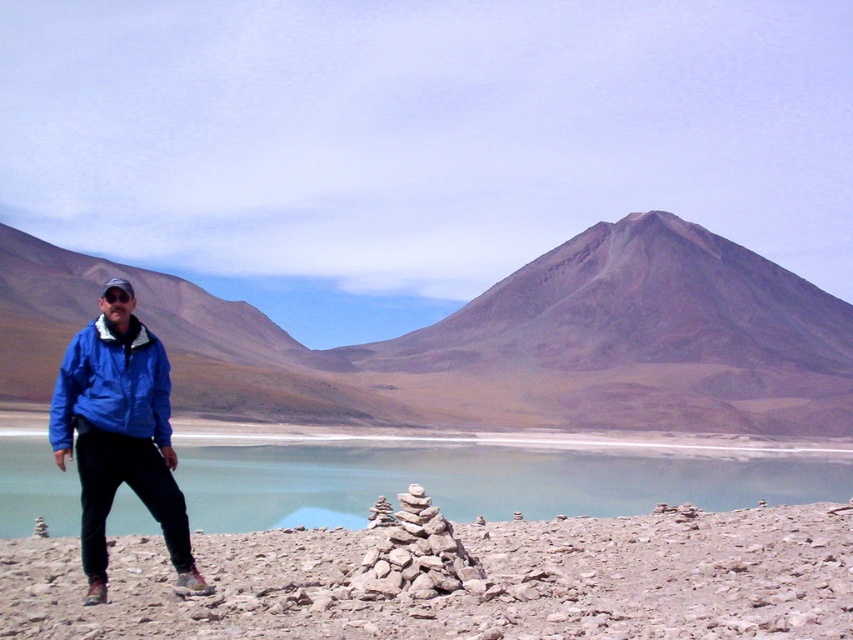
Question: Is blue fabric jacket at lower left above smooth gray stones at center?

Choices:
 (A) yes
 (B) no

Answer: (A)

Question: Estimate the real-world distances between objects in this image. Which object is closer to the greenish-blue water at center?

Choices:
 (A) smooth gray stones at center
 (B) blue fabric jacket at left
 (C) brown/dry soil mountain at center
 (D) blue fabric jacket at lower left

Answer: (A)

Question: Which point appears farthest from the camera in this image?

Choices:
 (A) (77, 390)
 (B) (354, 449)
 (C) (106, 384)

Answer: (B)

Question: Which object is positioned closest to the brown/dry soil mountain at center?

Choices:
 (A) blue fabric jacket at left
 (B) smooth gray stones at center
 (C) greenish-blue water at center

Answer: (C)

Question: Does brown/dry soil mountain at center appear on the right side of smooth gray stones at center?

Choices:
 (A) no
 (B) yes

Answer: (A)

Question: In this image, where is brown/dry soil mountain at center located relative to blue fabric jacket at lower left?

Choices:
 (A) above
 (B) below

Answer: (A)